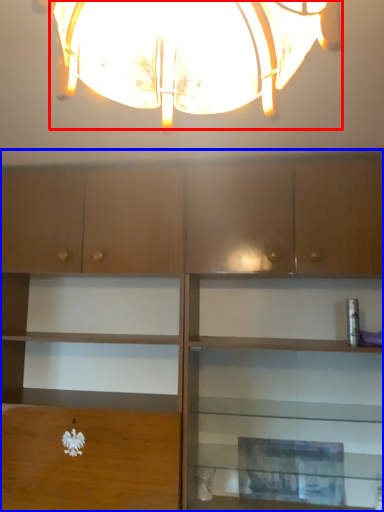
Question: Among these objects, which one is farthest to the camera, lamp (highlighted by a red box) or cabinetry (highlighted by a blue box)?

Choices:
 (A) lamp
 (B) cabinetry

Answer: (B)